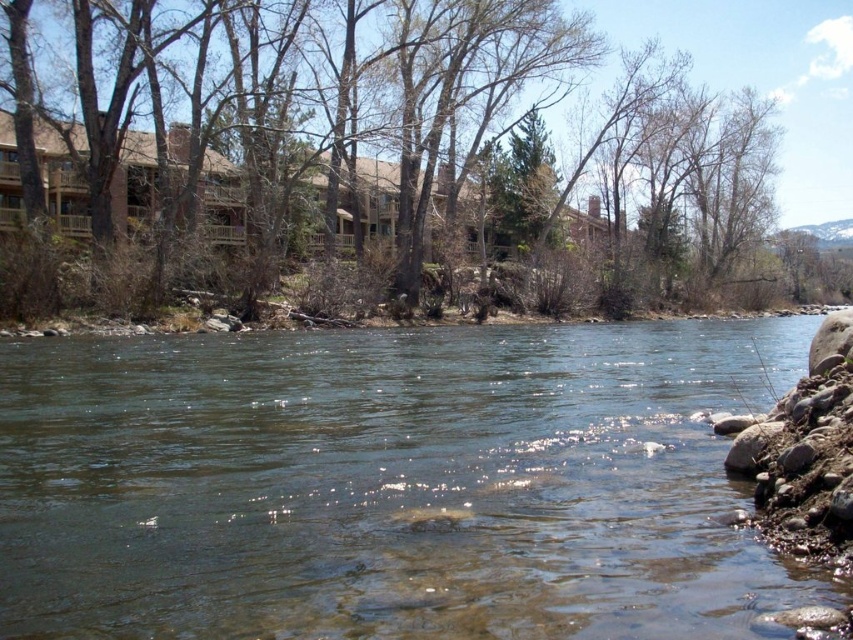
Question: Is clear water at center positioned in front of brown wood tree at upper center?

Choices:
 (A) yes
 (B) no

Answer: (A)

Question: Observing the image, what is the correct spatial positioning of clear water at center in reference to brown wood tree at upper center?

Choices:
 (A) below
 (B) above

Answer: (A)

Question: Does clear water at center appear under brown wood tree at upper center?

Choices:
 (A) no
 (B) yes

Answer: (B)

Question: Which point is closer to the camera?

Choices:
 (A) (115, 205)
 (B) (444, 440)

Answer: (B)

Question: Which of the following is the closest to the observer?

Choices:
 (A) brown wood tree at upper center
 (B) clear water at center

Answer: (B)